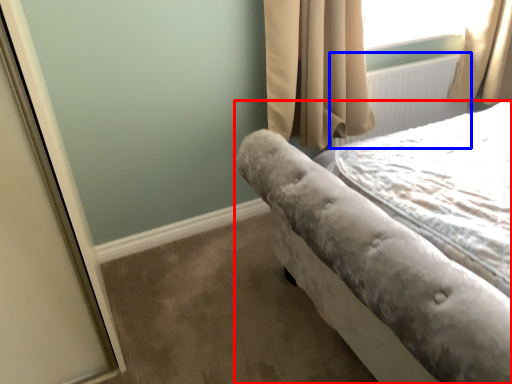
Question: Which point is further to the camera, bed (highlighted by a red box) or radiator (highlighted by a blue box)?

Choices:
 (A) bed
 (B) radiator

Answer: (B)